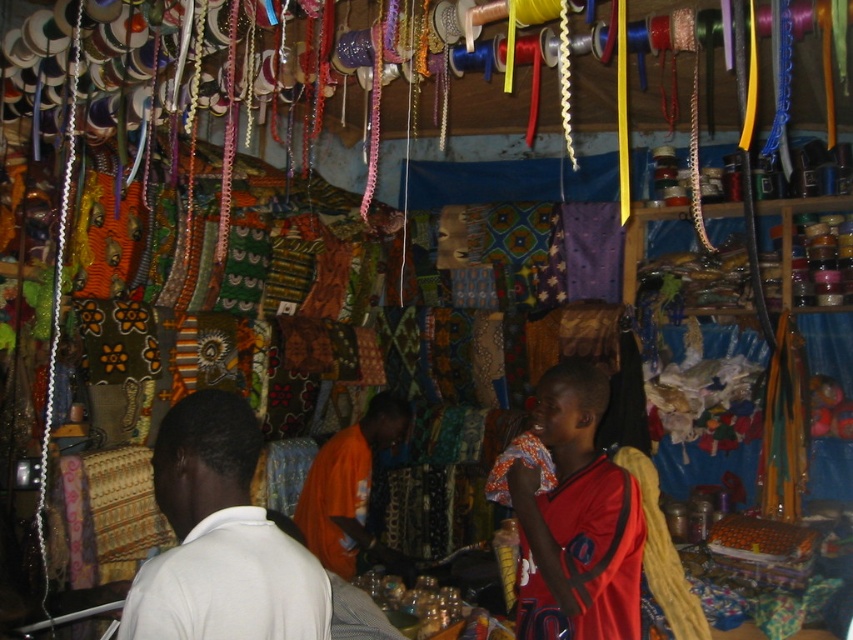
You are a photographer trying to capture a photo of the two people in the scene. The white matte shirt at center and the red jersey at center are both in your frame. Based on their positions, which one is closer to the camera?

The white matte shirt at center is above the red jersey at center, which suggests it is closer to the camera.

You are a customer at the fabric market looking to buy a new outfit. You notice the white matte shirt at center and the orange fabric at center. Which item is smaller in size?

The white matte shirt at center is smaller in size compared to the orange fabric at center.